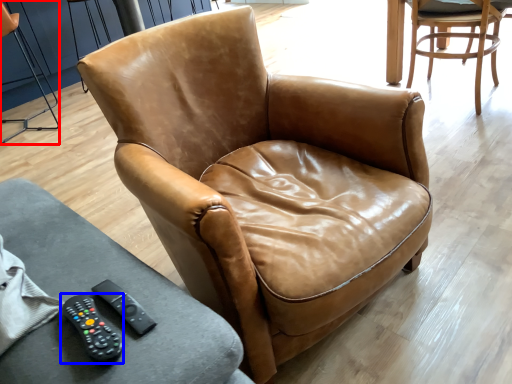
Question: Which object is closer to the camera taking this photo, chair (highlighted by a red box) or remote (highlighted by a blue box)?

Choices:
 (A) chair
 (B) remote

Answer: (B)